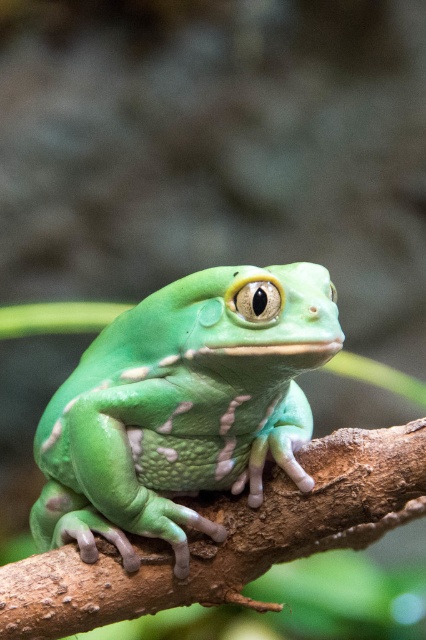
Is point (83, 364) more distant than point (86, 593)?

Yes, point (83, 364) is behind point (86, 593).

What do you see at coordinates (183, 406) in the screenshot? Image resolution: width=426 pixels, height=640 pixels. I see `green matte frog at center` at bounding box center [183, 406].

Who is more forward, (126, 529) or (402, 483)?

Positioned in front is point (402, 483).

Where is `green matte frog at center`? green matte frog at center is located at coordinates (183, 406).